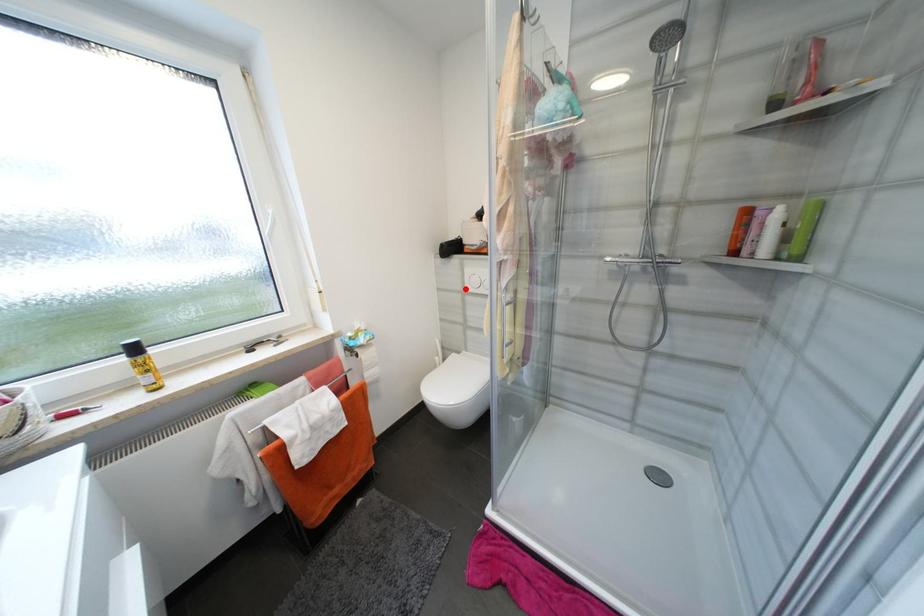
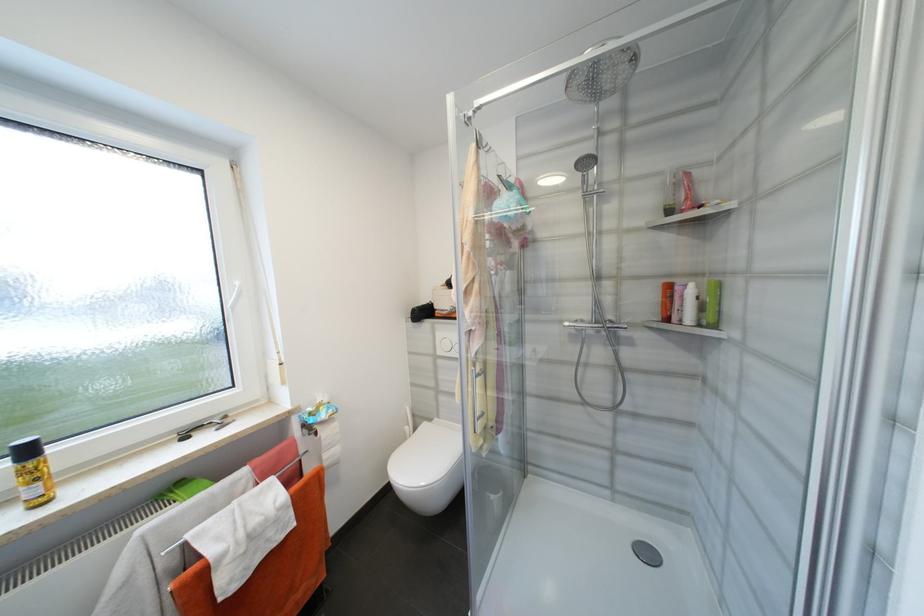
Question: I am providing you with two images of the same scene from different viewpoints. Given a red point in image1, look at the same physical point in image2. Is it:

Choices:
 (A) Closer to the viewpoint
 (B) Farther from the viewpoint

Answer: (B)